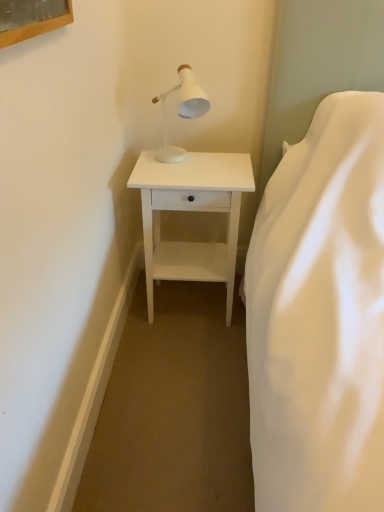
Identify the location of vacant space underneath white matte table lamp at upper center (from a real-world perspective). This screenshot has width=384, height=512. (187, 161).